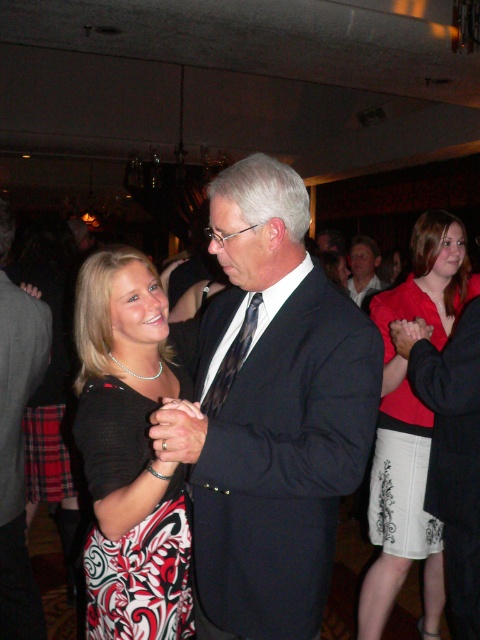
Question: Which of these objects is positioned closest to the matte red blouse at center?

Choices:
 (A) matte black suit at center
 (B) dark gray suit at center
 (C) black satin dress at center

Answer: (A)

Question: Is matte black suit at center to the right of black satin dress at center from the viewer's perspective?

Choices:
 (A) no
 (B) yes

Answer: (B)

Question: Is black satin dress at center thinner than matte red blouse at center?

Choices:
 (A) yes
 (B) no

Answer: (A)

Question: Which of the following is the closest to the observer?

Choices:
 (A) black satin dress at center
 (B) matte red blouse at center
 (C) matte black suit at center

Answer: (C)

Question: Which of the following is the closest to the observer?

Choices:
 (A) (13, 502)
 (B) (236, 340)
 (C) (371, 470)
 (D) (257, 324)

Answer: (D)

Question: Is matte black suit at center positioned at the back of matte red blouse at center?

Choices:
 (A) no
 (B) yes

Answer: (A)